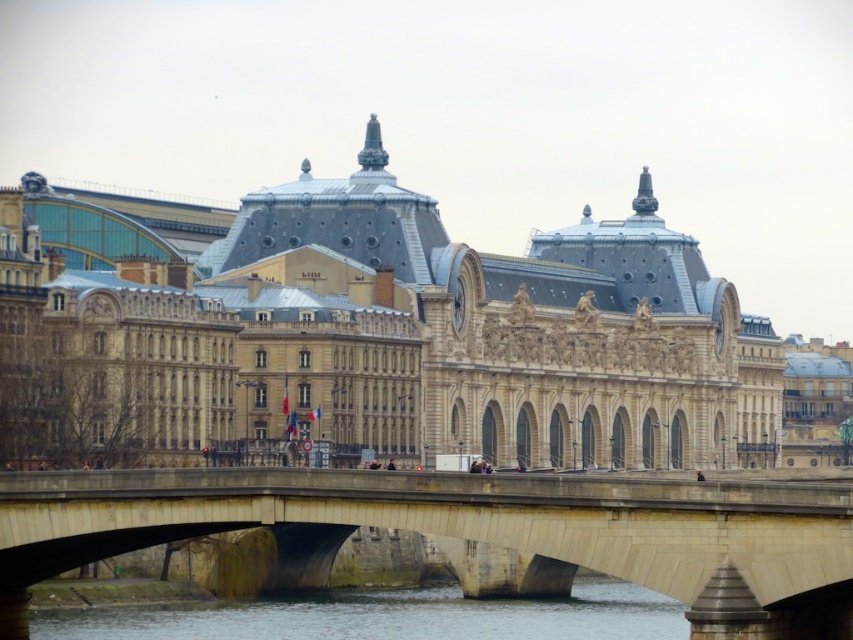
Question: Does beige stone palace at center appear over clear water at lower center?

Choices:
 (A) yes
 (B) no

Answer: (A)

Question: Which of the following is the farthest from the observer?

Choices:
 (A) clear water at lower center
 (B) beige stone bridge at center
 (C) beige stone palace at center

Answer: (C)

Question: Which object appears farthest from the camera in this image?

Choices:
 (A) beige stone bridge at center
 (B) beige stone palace at center

Answer: (B)

Question: Among these objects, which one is nearest to the camera?

Choices:
 (A) beige stone bridge at center
 (B) clear water at lower center

Answer: (A)

Question: Is beige stone bridge at center further to camera compared to clear water at lower center?

Choices:
 (A) no
 (B) yes

Answer: (A)

Question: Is beige stone palace at center bigger than beige stone bridge at center?

Choices:
 (A) no
 (B) yes

Answer: (B)